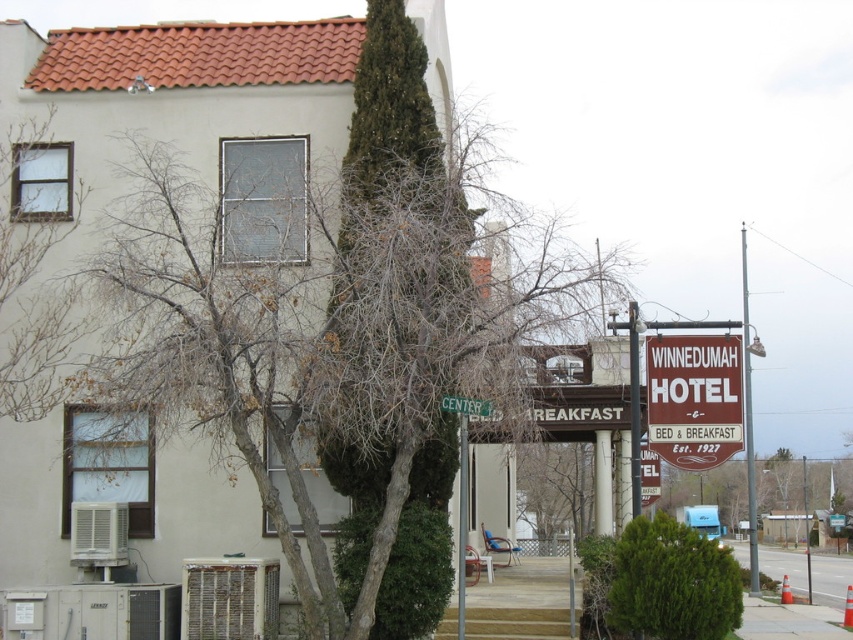
Who is higher up, green textured bush at center or brown wooden sign at center right?

Positioned higher is brown wooden sign at center right.

Does green textured bush at center come behind brown wooden sign at center right?

That is False.

Is point (619, 616) positioned after point (665, 410)?

No, it is not.

I want to click on green textured bush at center, so click(659, 582).

Which is above, green leafy tree at center or white plastic street sign at center?

white plastic street sign at center is higher up.

Measure the distance between point (811, 490) and camera.

Point (811, 490) is 205.91 feet away from camera.

Locate an element on the screen. green leafy tree at center is located at coordinates pyautogui.click(x=799, y=492).

In the scene shown: Between green textured bush at center and white plastic street sign at center, which one appears on the left side from the viewer's perspective?

From the viewer's perspective, white plastic street sign at center appears more on the left side.

Is point (682, 561) in front of point (469, 400)?

No.

Is point (691, 632) positioned before point (442, 403)?

That is False.

Where is `green textured bush at center`? The height and width of the screenshot is (640, 853). green textured bush at center is located at coordinates (659, 582).